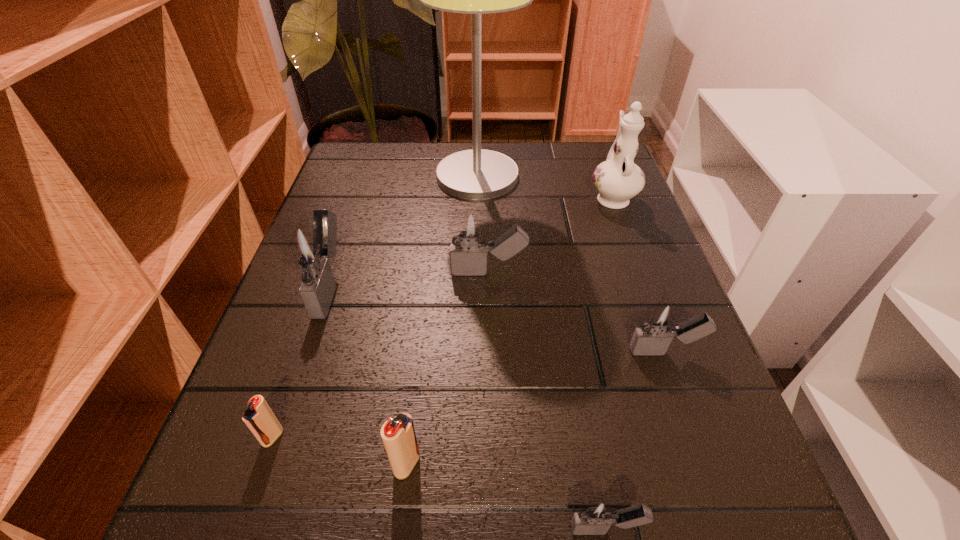
Find the location of `blank space at the near left corner of the desktop`. blank space at the near left corner of the desktop is located at coordinates (291, 491).

Where is `free space at the far right corner of the desktop`? free space at the far right corner of the desktop is located at coordinates (582, 169).

You are a GUI agent. You are given a task and a screenshot of the screen. Output one action in this format:
    pyautogui.click(x=<x>, y=<y>)
    Task: Click on the free space between the rightmost gray igniter and the left red igniter
    This screenshot has height=540, width=960.
    Given the screenshot: What is the action you would take?
    pyautogui.click(x=468, y=394)

Image resolution: width=960 pixels, height=540 pixels. In order to click on unoccupied position between the fourth tallest object and the fourth nearest object in this screenshot , I will do `click(577, 312)`.

The width and height of the screenshot is (960, 540). I want to click on free point between the fifth shortest igniter and the seventh farthest object, so click(447, 368).

Identify the location of vacant area between the third farthest igniter and the smaller red igniter. The width and height of the screenshot is (960, 540). (468, 394).

At what (x,y) coordinates should I click in order to perform the action: click on vacant area between the left red igniter and the second nearest gray igniter. Please return your answer as a coordinate pair (x, y). Image resolution: width=960 pixels, height=540 pixels. Looking at the image, I should click on (468, 394).

The width and height of the screenshot is (960, 540). I want to click on object that ranks as the seventh closest to the bigger red igniter, so [618, 179].

Identify which object is the seventh nearest to the third smallest gray igniter. Please provide its 2D coordinates. Your answer should be formatted as a tuple, i.e. [(x, y)], where the tuple contains the x and y coordinates of a point satisfying the conditions above.

[(595, 518)]

Where is `igniter identified as the closest to the fifth shortest object`? This screenshot has width=960, height=540. igniter identified as the closest to the fifth shortest object is located at coordinates (311, 249).